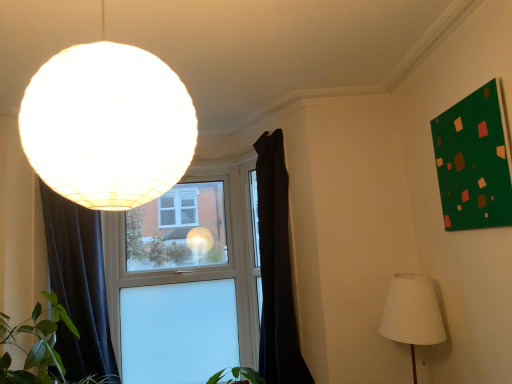
Question: Should I look upward or downward to see matte white globe at upper left, which is the 2th lamp in back-to-front order?

Choices:
 (A) up
 (B) down

Answer: (A)

Question: Can you confirm if white fabric lampshade at lower right, acting as the first lamp starting from the bottom, is smaller than matte white globe at upper left, which is the 2th lamp in back-to-front order?

Choices:
 (A) yes
 (B) no

Answer: (B)

Question: Is white fabric lampshade at lower right, acting as the first lamp starting from the bottom, at the right side of matte white globe at upper left, which ranks as the 1th lamp in top-to-bottom order?

Choices:
 (A) no
 (B) yes

Answer: (B)

Question: Does white fabric lampshade at lower right, the first lamp when ordered from back to front, appear on the left side of matte white globe at upper left, positioned as the 2th lamp in right-to-left order?

Choices:
 (A) no
 (B) yes

Answer: (A)

Question: Is white fabric lampshade at lower right, marked as the first lamp in a right-to-left arrangement, aimed at matte white globe at upper left, positioned as the 2th lamp in right-to-left order?

Choices:
 (A) yes
 (B) no

Answer: (B)

Question: Is white fabric lampshade at lower right, marked as the first lamp in a right-to-left arrangement, further to camera compared to matte white globe at upper left, acting as the second lamp starting from the bottom?

Choices:
 (A) yes
 (B) no

Answer: (A)

Question: Is white fabric lampshade at lower right, the second lamp from the left, positioned with its back to matte white globe at upper left, acting as the second lamp starting from the bottom?

Choices:
 (A) yes
 (B) no

Answer: (B)

Question: Is dark fabric curtain at center, which is the 2th curtain in left-to-right order, smaller than matte white globe at upper left, which ranks as the 1th lamp in top-to-bottom order?

Choices:
 (A) yes
 (B) no

Answer: (B)

Question: Is dark fabric curtain at center, which is the 2th curtain in left-to-right order, wider than matte white globe at upper left, arranged as the 1th lamp when viewed from the left?

Choices:
 (A) yes
 (B) no

Answer: (B)

Question: Does dark fabric curtain at center, which is the 2th curtain in left-to-right order, have a larger size compared to matte white globe at upper left, which ranks as the 1th lamp in top-to-bottom order?

Choices:
 (A) yes
 (B) no

Answer: (A)

Question: Is the depth of dark fabric curtain at center, which is the 2th curtain in left-to-right order, less than that of matte white globe at upper left, arranged as the 1th lamp when viewed from the left?

Choices:
 (A) no
 (B) yes

Answer: (A)

Question: Does dark fabric curtain at center, which is the 1th curtain in right-to-left order, appear on the left side of matte white globe at upper left, which ranks as the 1th lamp in top-to-bottom order?

Choices:
 (A) no
 (B) yes

Answer: (A)

Question: Is dark fabric curtain at center, which is the 2th curtain in left-to-right order, far away from matte white globe at upper left, acting as the second lamp starting from the bottom?

Choices:
 (A) yes
 (B) no

Answer: (A)

Question: From a real-world perspective, is dark fabric curtain at left, which is the first curtain in left-to-right order, physically above white fabric lampshade at lower right, acting as the first lamp starting from the bottom?

Choices:
 (A) no
 (B) yes

Answer: (B)